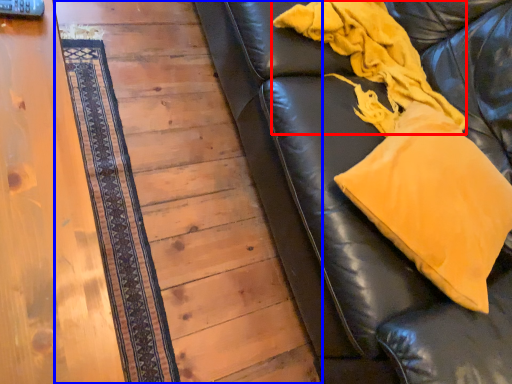
Question: Which of the following is the farthest to the observer, blanket (highlighted by a red box) or panel (highlighted by a blue box)?

Choices:
 (A) blanket
 (B) panel

Answer: (B)